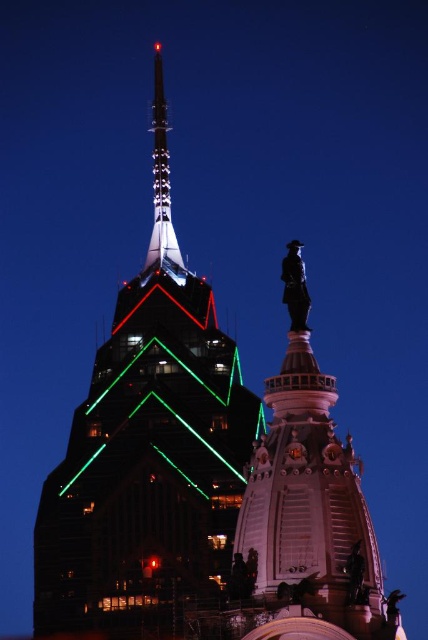
Question: From the image, what is the correct spatial relationship of polished bronze statue at center in relation to shiny metallic spire at upper center?

Choices:
 (A) below
 (B) above

Answer: (A)

Question: Which of the following is the farthest from the observer?

Choices:
 (A) metallic glass skyscraper at center
 (B) shiny metallic spire at upper center

Answer: (B)

Question: Can you confirm if metallic glass skyscraper at center is positioned below polished bronze statue at center?

Choices:
 (A) yes
 (B) no

Answer: (B)

Question: Does polished bronze statue at center have a larger size compared to shiny metallic spire at upper center?

Choices:
 (A) yes
 (B) no

Answer: (B)

Question: Which of the following is the closest to the observer?

Choices:
 (A) shiny metallic spire at upper center
 (B) metallic glass skyscraper at center
 (C) polished bronze statue at center

Answer: (C)

Question: Which object is the closest to the polished bronze statue at center?

Choices:
 (A) shiny metallic spire at upper center
 (B) metallic glass skyscraper at center

Answer: (B)